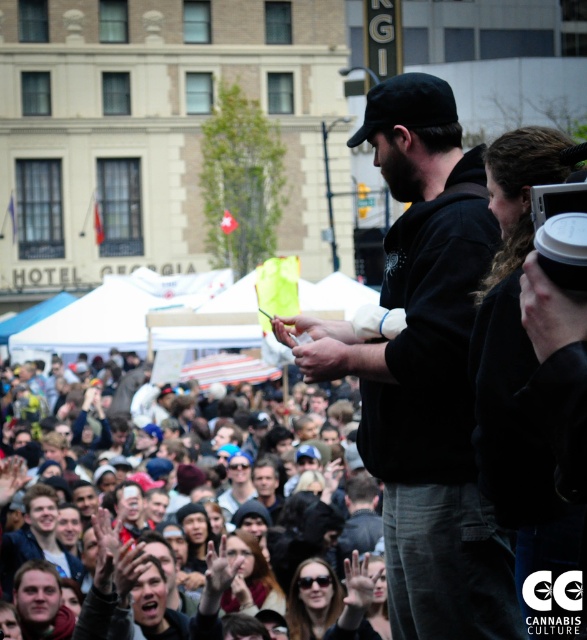
Question: Which of these objects is positioned closest to the blurred crowd at center?

Choices:
 (A) matte black shirt at center
 (B) light brown hair at center
 (C) black matte jacket at center

Answer: (B)

Question: Does black matte jacket at center appear under blurred crowd at center?

Choices:
 (A) no
 (B) yes

Answer: (A)

Question: Does matte black shirt at center lie in front of light brown hair at center?

Choices:
 (A) yes
 (B) no

Answer: (B)

Question: Does blurred crowd at center have a smaller size compared to matte black shirt at center?

Choices:
 (A) yes
 (B) no

Answer: (B)

Question: Which point is farther from the camera taking this photo?

Choices:
 (A) (72, 621)
 (B) (220, 600)

Answer: (A)

Question: Which of the following is the farthest from the observer?

Choices:
 (A) matte black shirt at center
 (B) black matte jacket at center
 (C) light brown hair at center

Answer: (A)